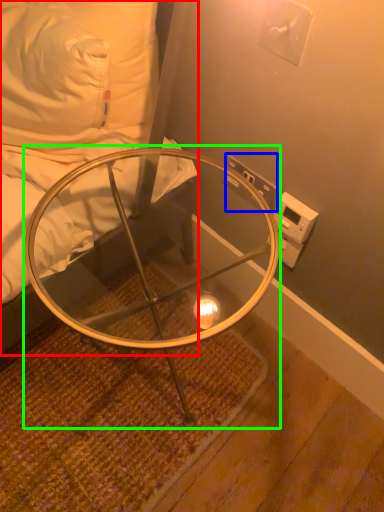
Question: Which object is positioned closest to furniture (highlighted by a red box)? Select from electric outlet (highlighted by a blue box) and table (highlighted by a green box).

Choices:
 (A) electric outlet
 (B) table

Answer: (B)